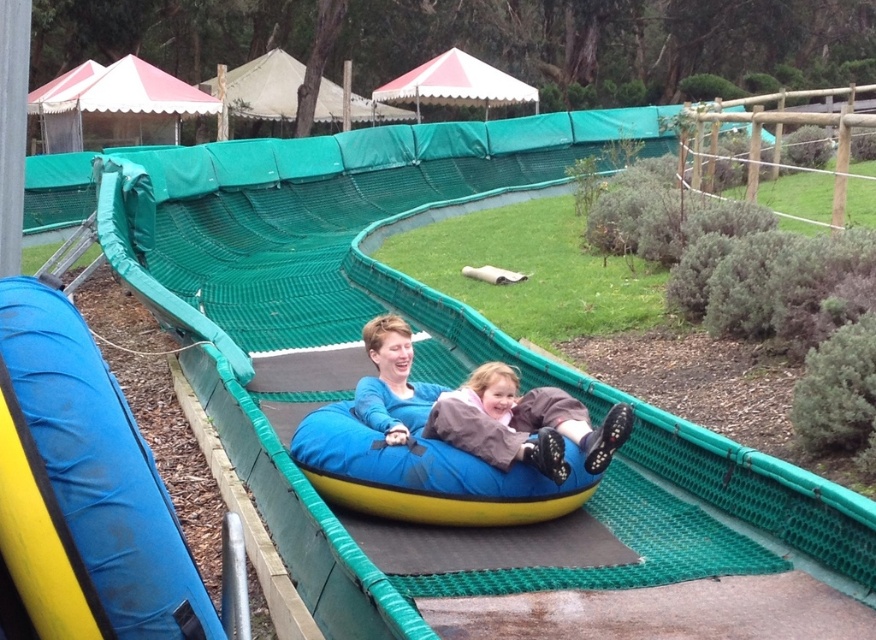
From the picture: Is blue rubber slide at center below blue rubber tube at center?

Actually, blue rubber slide at center is above blue rubber tube at center.

Which is more to the left, blue rubber slide at center or blue rubber tube at center?

blue rubber slide at center

Does point (154, 620) come farther from viewer compared to point (471, 474)?

No, (154, 620) is in front of (471, 474).

This screenshot has height=640, width=876. I want to click on blue rubber slide at center, so click(100, 468).

Between blue rubber slide at center and blue matte sweater at center, which one appears on the right side from the viewer's perspective?

Positioned to the right is blue matte sweater at center.

What do you see at coordinates (100, 468) in the screenshot? I see `blue rubber slide at center` at bounding box center [100, 468].

Is point (86, 524) farther from viewer compared to point (397, 390)?

No, (86, 524) is closer to viewer.

Find the location of a particular element. blue rubber slide at center is located at coordinates (100, 468).

Is blue rubber tube at center to the right of blue matte sweater at center from the viewer's perspective?

Correct, you'll find blue rubber tube at center to the right of blue matte sweater at center.

Is blue rubber tube at center below blue matte sweater at center?

Indeed, blue rubber tube at center is positioned under blue matte sweater at center.

What do you see at coordinates (425, 476) in the screenshot? I see `blue rubber tube at center` at bounding box center [425, 476].

Identify the location of blue rubber tube at center. The height and width of the screenshot is (640, 876). (425, 476).